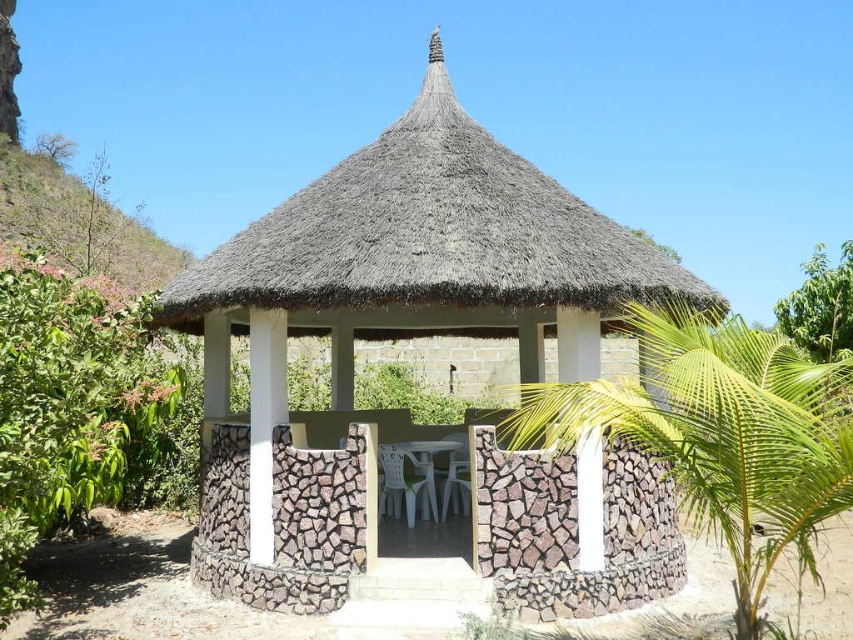
Question: Which point appears farthest from the camera in this image?

Choices:
 (A) (334, 321)
 (B) (712, 472)

Answer: (A)

Question: Which point is farther to the camera?

Choices:
 (A) thatched roof hut at center
 (B) green leafy palm tree at center

Answer: (A)

Question: Is thatched roof hut at center further to camera compared to green leafy palm tree at center?

Choices:
 (A) yes
 (B) no

Answer: (A)

Question: In this image, where is thatched roof hut at center located relative to green leafy palm tree at center?

Choices:
 (A) above
 (B) below

Answer: (A)

Question: Among these points, which one is farthest from the camera?

Choices:
 (A) (683, 385)
 (B) (218, 326)

Answer: (B)

Question: Where is thatched roof hut at center located in relation to green leafy palm tree at center in the image?

Choices:
 (A) right
 (B) left

Answer: (B)